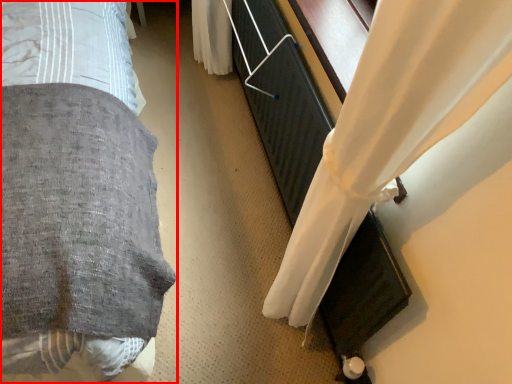
Question: Where is bed (annotated by the red box) located in relation to curtain in the image?

Choices:
 (A) left
 (B) right

Answer: (A)